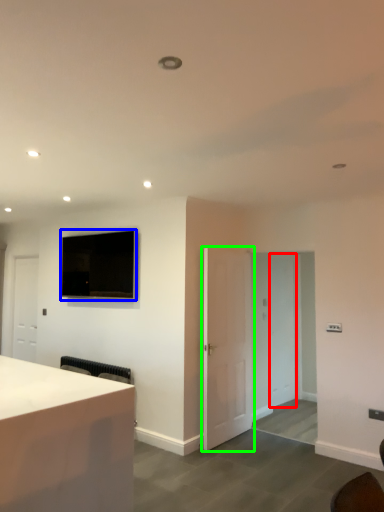
Question: Which is farther away from glass door (highlighted by a red box)? television (highlighted by a blue box) or door (highlighted by a green box)?

Choices:
 (A) television
 (B) door

Answer: (A)